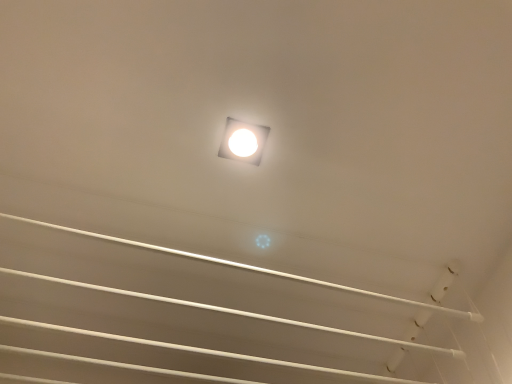
This screenshot has height=384, width=512. What do you see at coordinates (243, 141) in the screenshot? I see `white glossy square at center` at bounding box center [243, 141].

What is the approximate width of white glossy square at center?

white glossy square at center is 4.01 inches wide.

You are a GUI agent. You are given a task and a screenshot of the screen. Output one action in this format:
    pyautogui.click(x=<x>, y=<y>)
    Task: Click on the white glossy square at center
    
    Given the screenshot: What is the action you would take?
    pyautogui.click(x=243, y=141)

Locate an element on the screen. white glossy ceiling at upper center is located at coordinates (238, 313).

What do you see at coordinates (238, 313) in the screenshot? I see `white glossy ceiling at upper center` at bounding box center [238, 313].

In order to click on white glossy square at center in this screenshot , I will do `click(243, 141)`.

Would you say white glossy square at center is to the left or to the right of white glossy ceiling at upper center in the picture?

Based on their positions, white glossy square at center is located to the right of white glossy ceiling at upper center.

Is white glossy square at center further to camera compared to white glossy ceiling at upper center?

Yes.

Which is further, (238, 122) or (440, 296)?

Positioned behind is point (440, 296).

From the image's perspective, is white glossy square at center below white glossy ceiling at upper center?

No, from the image's perspective, white glossy square at center is not beneath white glossy ceiling at upper center.

Consider the image. From a real-world perspective, is white glossy square at center physically located above or below white glossy ceiling at upper center?

white glossy square at center is above white glossy ceiling at upper center.

Considering the sizes of objects white glossy square at center and white glossy ceiling at upper center in the image provided, who is wider, white glossy square at center or white glossy ceiling at upper center?

white glossy ceiling at upper center.

Is white glossy square at center shorter than white glossy ceiling at upper center?

Yes.

Consider the image. Is white glossy square at center smaller than white glossy ceiling at upper center?

Correct, white glossy square at center occupies less space than white glossy ceiling at upper center.

Is white glossy ceiling at upper center inside white glossy square at center?

Definitely not — white glossy ceiling at upper center is not inside white glossy square at center.

Is the surface of white glossy square at center in direct contact with white glossy ceiling at upper center?

No, white glossy square at center is not making contact with white glossy ceiling at upper center.

Is white glossy square at center facing away from white glossy ceiling at upper center?

white glossy square at center does not have its back to white glossy ceiling at upper center.

Can you tell me how much white glossy square at center and white glossy ceiling at upper center differ in facing direction?

The facing directions of white glossy square at center and white glossy ceiling at upper center are 2.11 degrees apart.

Find the location of a particular element. This screenshot has height=384, width=512. stairwell below the white glossy square at center (from the image's perspective) is located at coordinates (238, 313).

Can you confirm if white glossy ceiling at upper center is positioned to the right of white glossy square at center?

In fact, white glossy ceiling at upper center is to the left of white glossy square at center.

Is white glossy ceiling at upper center closer to camera compared to white glossy square at center?

Yes, white glossy ceiling at upper center is closer to the viewer.

Is point (349, 289) positioned in front of point (231, 119)?

No, it is behind (231, 119).

From the image's perspective, is white glossy ceiling at upper center on white glossy square at center?

Actually, white glossy ceiling at upper center appears below white glossy square at center in the image.

From a real-world perspective, which object stands above the other?

white glossy square at center, from a real-world perspective.

Does white glossy ceiling at upper center have a lesser width compared to white glossy square at center?

No, white glossy ceiling at upper center is not thinner than white glossy square at center.

From the picture: Can you confirm if white glossy ceiling at upper center is taller than white glossy square at center?

Yes, white glossy ceiling at upper center is taller than white glossy square at center.

From the picture: Who is smaller, white glossy ceiling at upper center or white glossy square at center?

white glossy square at center.

Is white glossy square at center a part of white glossy ceiling at upper center?

No, white glossy square at center is not inside white glossy ceiling at upper center.

Is white glossy ceiling at upper center positioned far away from white glossy square at center?

That's not correct — white glossy ceiling at upper center is a little close to white glossy square at center.

Is white glossy ceiling at upper center aimed at white glossy square at center?

Yes.

How many degrees apart are the facing directions of white glossy ceiling at upper center and white glossy square at center?

The facing directions of white glossy ceiling at upper center and white glossy square at center are 2.11 degrees apart.

Where is `lamp behind the white glossy ceiling at upper center`? lamp behind the white glossy ceiling at upper center is located at coordinates (243, 141).

Locate an element on the screen. Image resolution: width=512 pixels, height=384 pixels. stairwell beneath the white glossy square at center (from a real-world perspective) is located at coordinates (238, 313).

Locate an element on the screen. Image resolution: width=512 pixels, height=384 pixels. lamp above the white glossy ceiling at upper center (from a real-world perspective) is located at coordinates (243, 141).